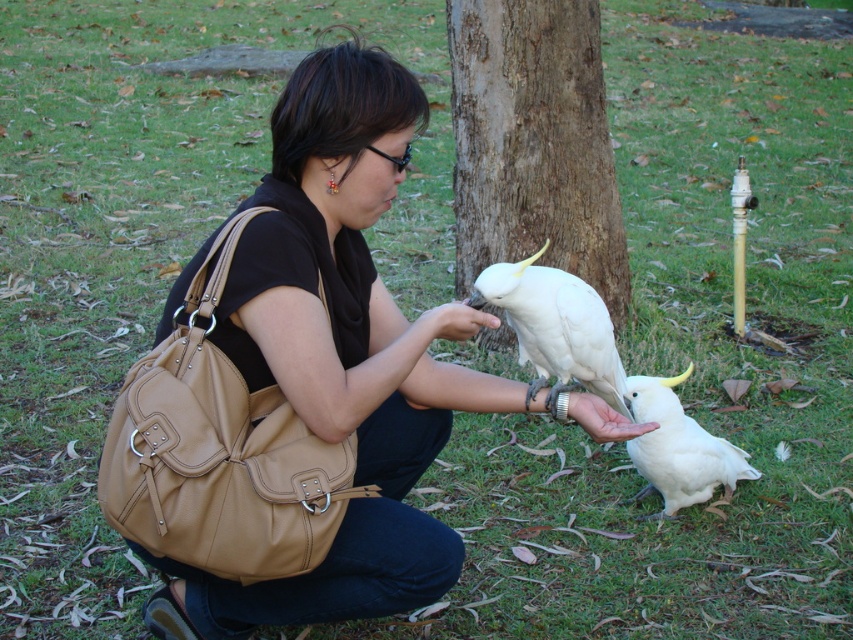
You are a photographer wanting to capture a clear photo of the white matte parrot at lower right and the brown rough tree trunk at center. Which object should you focus on first to ensure both are in focus?

You should focus on the brown rough tree trunk at center first because the white matte parrot at lower right is behind it, so focusing on the closer object will help both be in focus.

You are a painter setting up an easel to paint the scene. You want to ensure the brown rough tree trunk at center and the white feathered parrot at center are proportionally accurate in your painting. Which object should you draw wider in your artwork?

The brown rough tree trunk at center should be drawn wider than the white feathered parrot at center because the brown rough tree trunk at center is larger in width compared to the white feathered parrot at center.